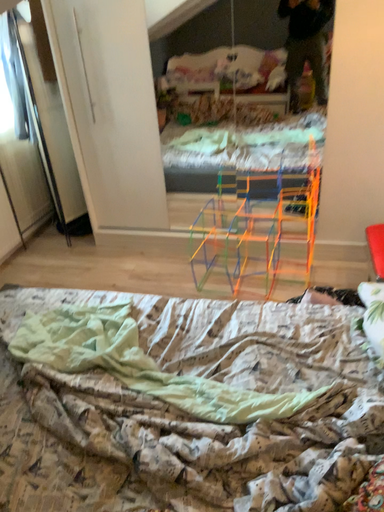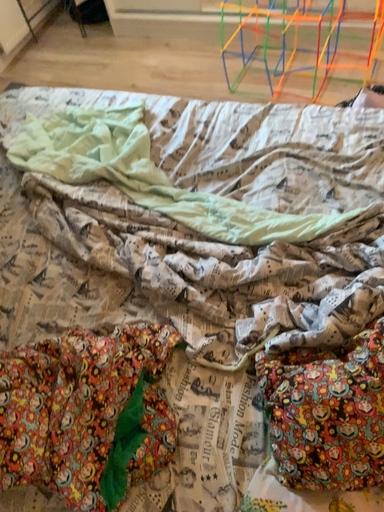
Question: Which way did the camera rotate in the video?

Choices:
 (A) rotated upward
 (B) rotated downward

Answer: (B)